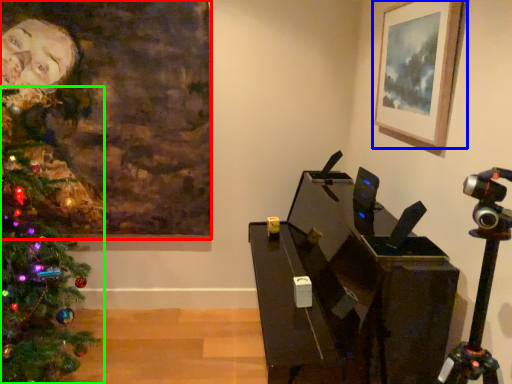
Question: Based on their relative distances, which object is farther from picture frame (highlighted by a red box)? Choose from picture frame (highlighted by a blue box) and christmas tree (highlighted by a green box).

Choices:
 (A) picture frame
 (B) christmas tree

Answer: (A)